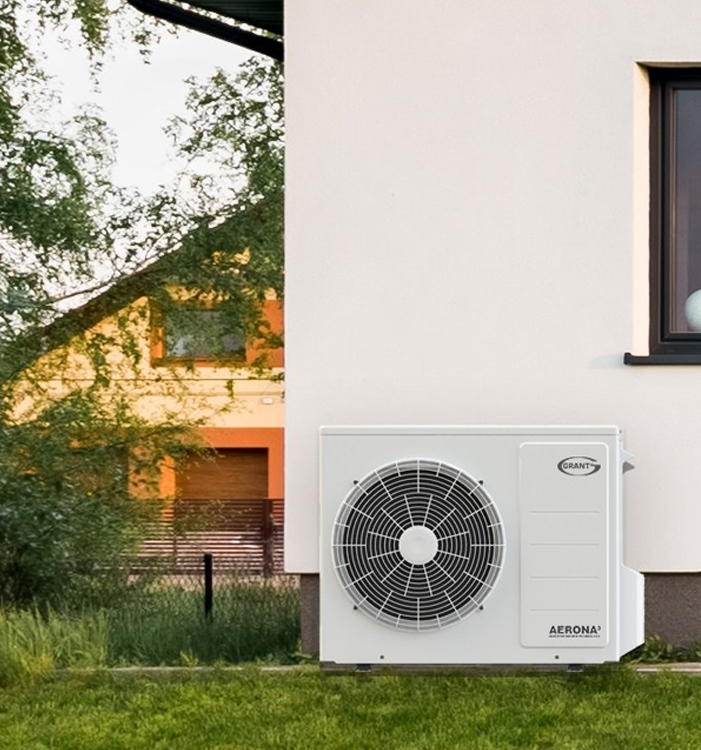
This screenshot has height=750, width=701. Identify the location of windowsill. (673, 345).